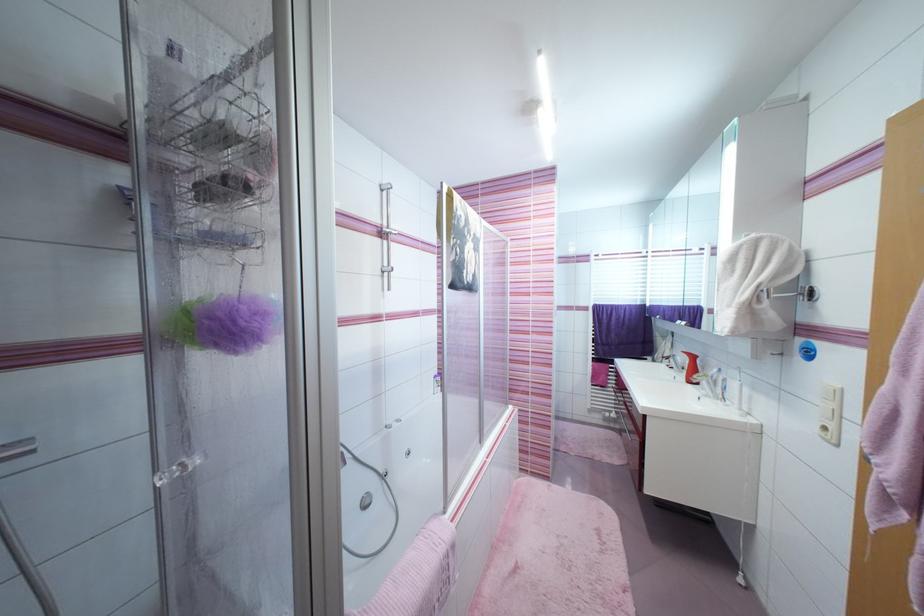
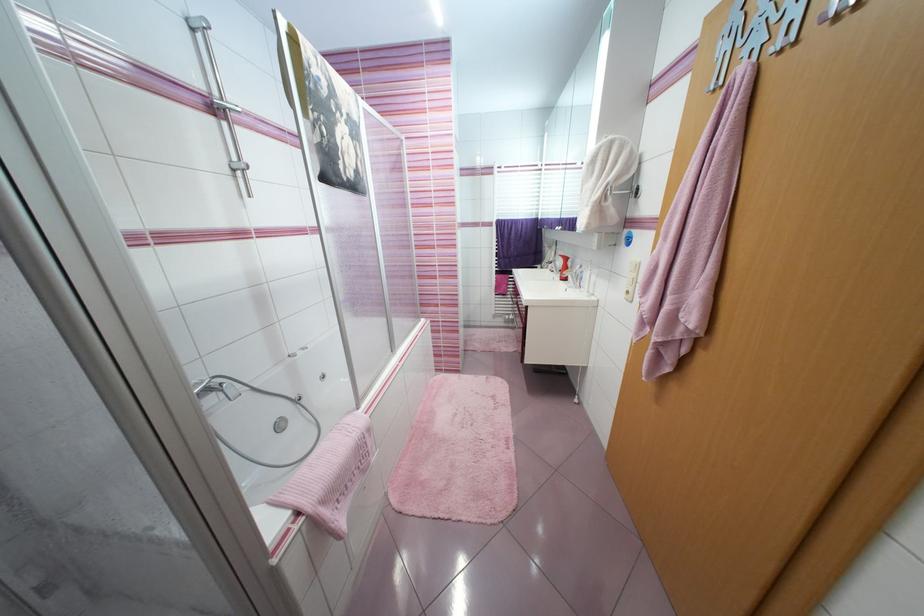
Locate, in the second image, the point that corresponds to the point at 395,270 in the first image.

(249, 167)